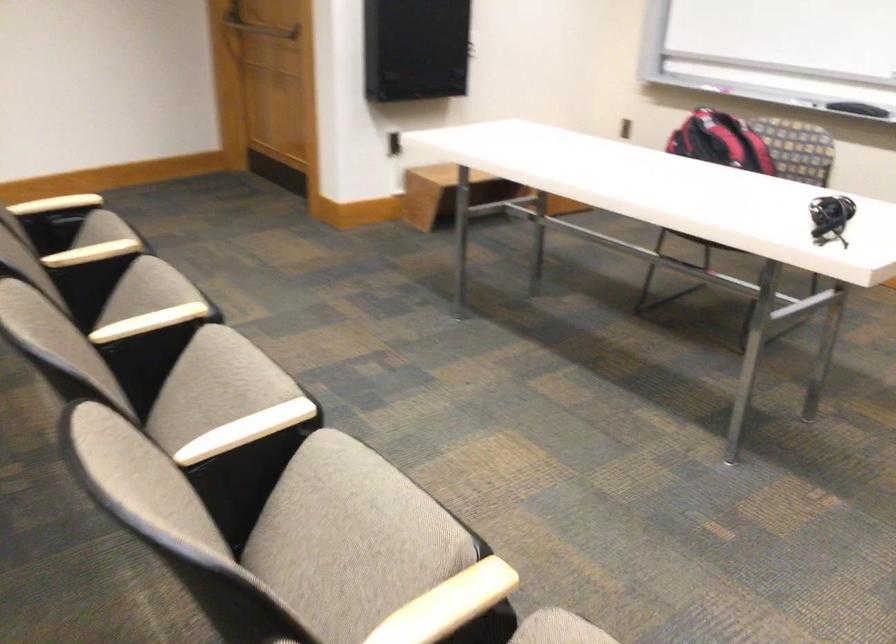
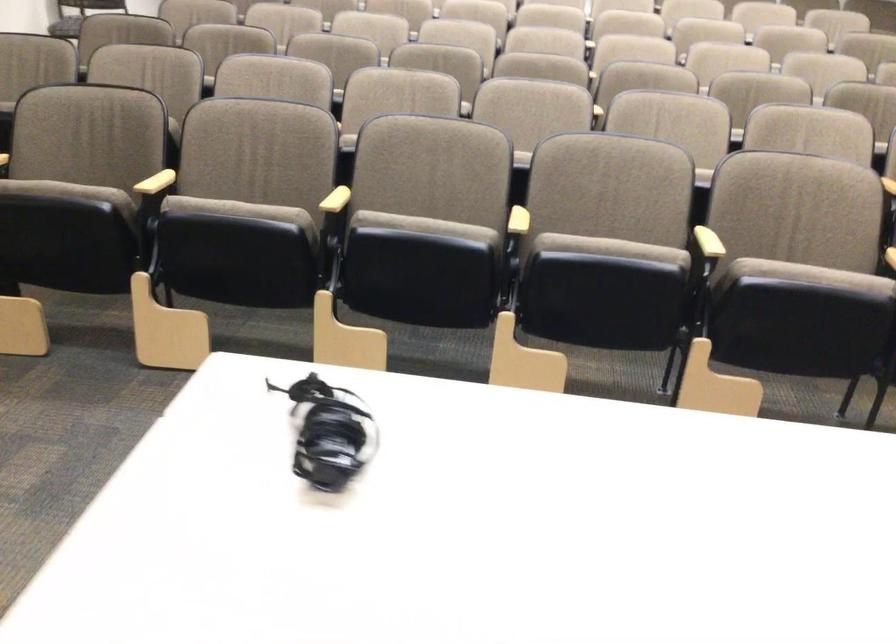
Locate, in the second image, the point that corresponds to pixel 229 366 in the first image.

(610, 249)